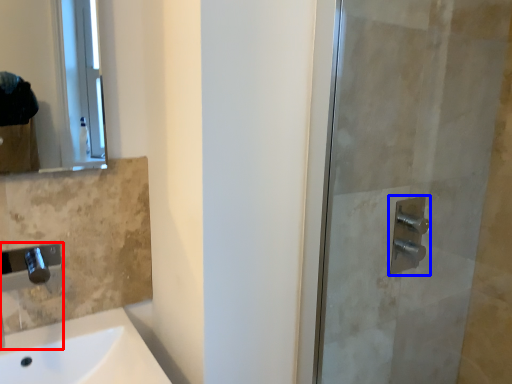
Question: Which of the following is the farthest to the observer, faucet (highlighted by a red box) or shower (highlighted by a blue box)?

Choices:
 (A) faucet
 (B) shower

Answer: (B)